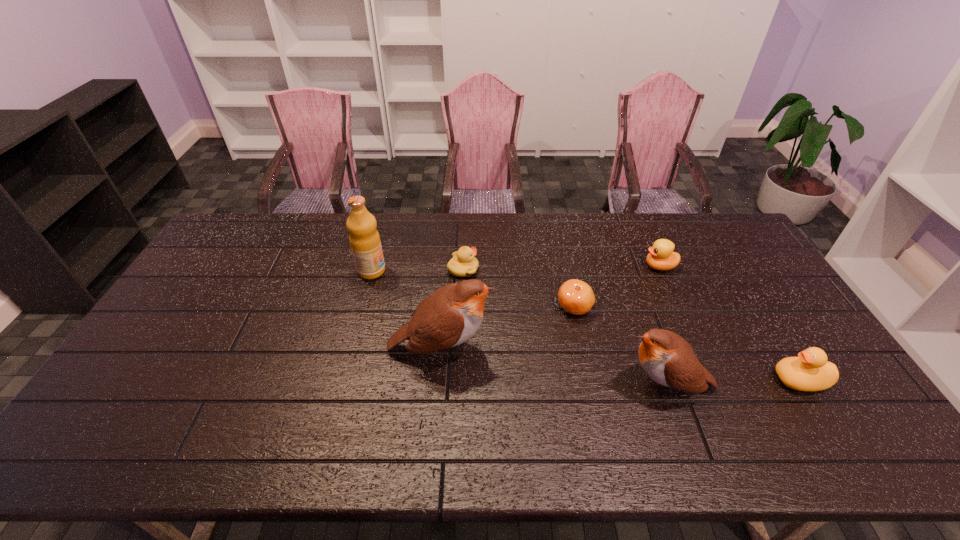
In the image, there is a desktop. What are the coordinates of `vacant region at the near left corner` in the screenshot? It's located at (147, 397).

The height and width of the screenshot is (540, 960). In the image, there is a desktop. What are the coordinates of `blank space at the far right corner` in the screenshot? It's located at (723, 214).

Find the location of a particular element. This screenshot has height=540, width=960. vacant space that's between the duck and the third tallest object is located at coordinates (733, 383).

Where is `free area in between the fourth farthest object and the third tallest object`? The height and width of the screenshot is (540, 960). free area in between the fourth farthest object and the third tallest object is located at coordinates (620, 346).

The height and width of the screenshot is (540, 960). Find the location of `vacant space that's between the rightmost object and the left bird`. vacant space that's between the rightmost object and the left bird is located at coordinates (620, 364).

You are a GUI agent. You are given a task and a screenshot of the screen. Output one action in this format:
    pyautogui.click(x=<x>, y=<y>)
    Task: Click on the free space that is in between the left duckling and the right duckling
    This screenshot has width=960, height=540.
    Given the screenshot: What is the action you would take?
    pyautogui.click(x=562, y=268)

What are the coordinates of `empty space that is in between the taller bird and the right duckling` in the screenshot? It's located at (550, 308).

Find the location of a particular element. Image resolution: width=960 pixels, height=540 pixels. vacant area that lies between the fifth shortest object and the fruit juice is located at coordinates (519, 328).

Find the location of `vacant area that lies between the fourth object from right to left and the left duckling`. vacant area that lies between the fourth object from right to left and the left duckling is located at coordinates (518, 288).

This screenshot has height=540, width=960. What are the coordinates of `vacant space that is in between the shorter bird and the taller bird` in the screenshot? It's located at (554, 367).